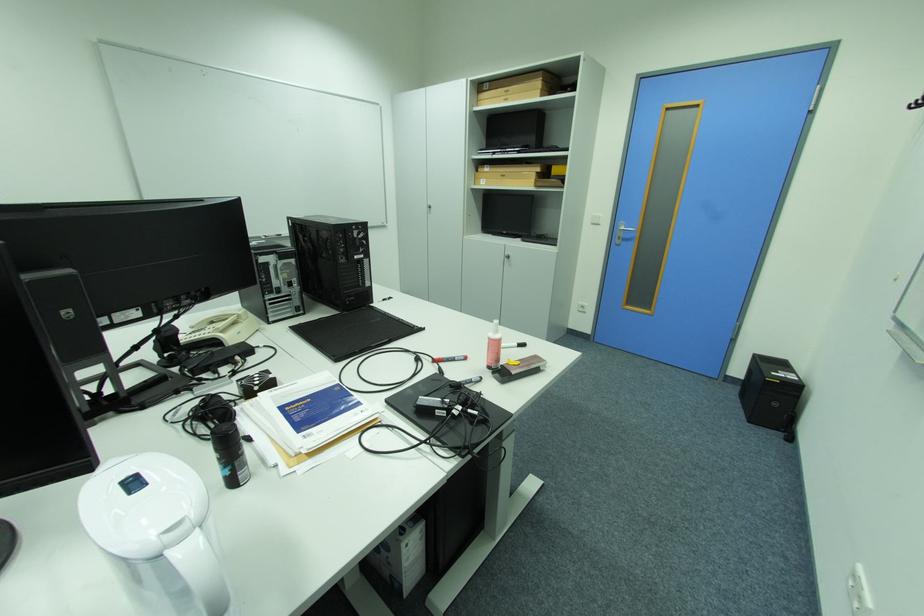
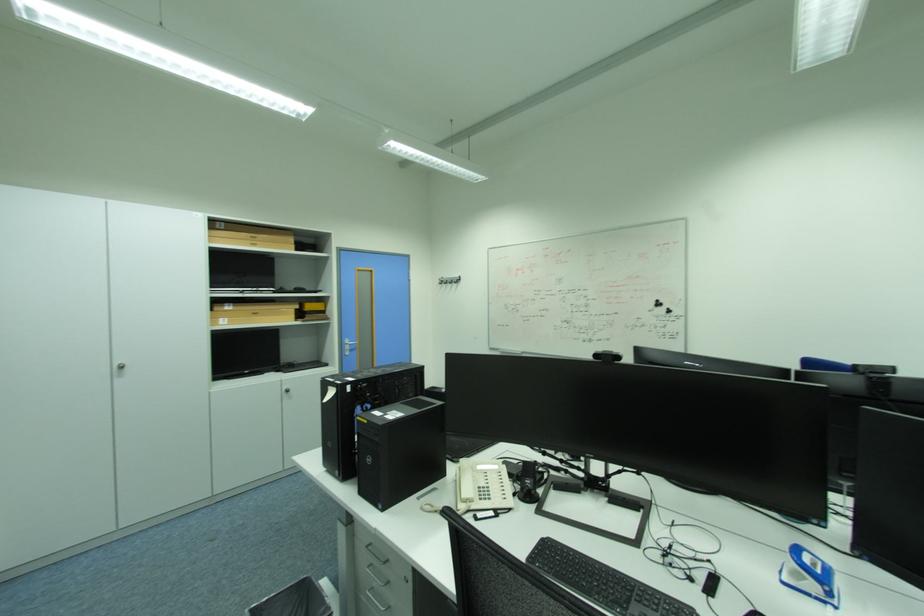
In the second image, find the point that corresponds to [514,100] in the first image.

(261, 246)